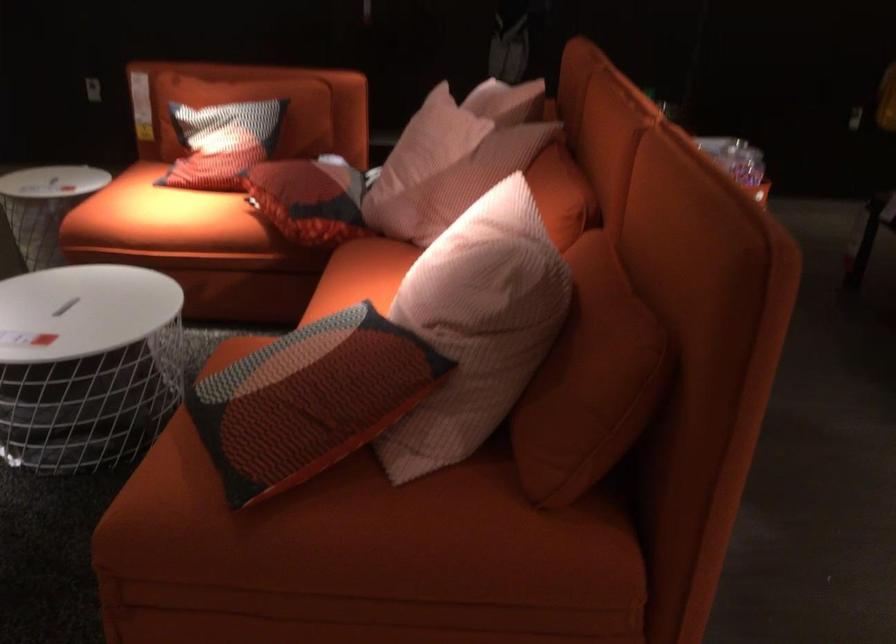
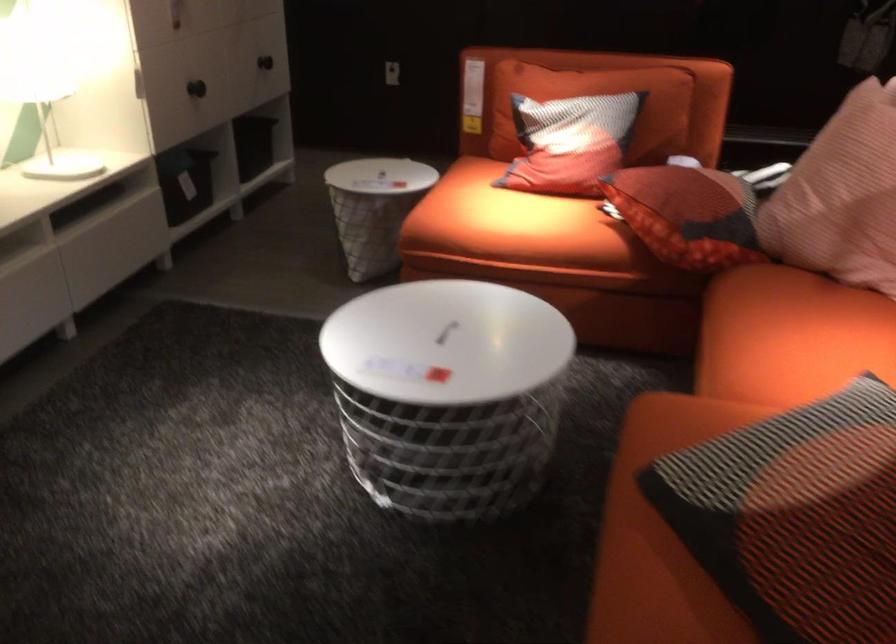
Which direction would the cameraman need to move to produce the second image?

The cameraman moved toward left, forward.